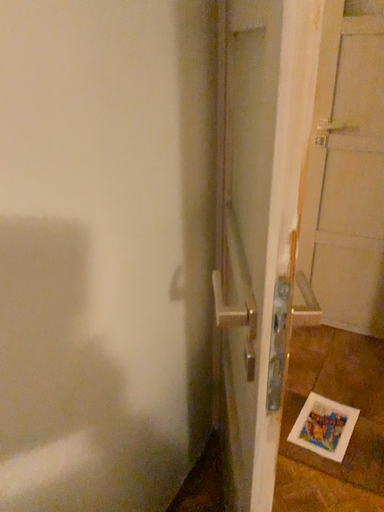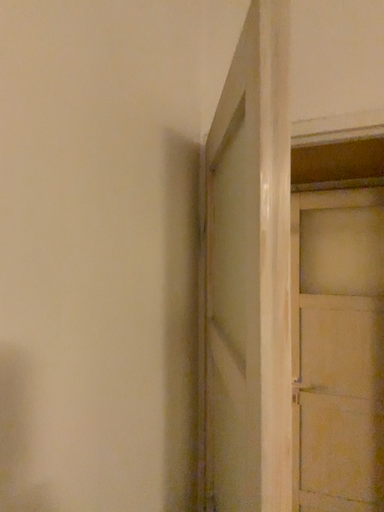
Question: How did the camera likely rotate when shooting the video?

Choices:
 (A) rotated downward
 (B) rotated upward

Answer: (B)